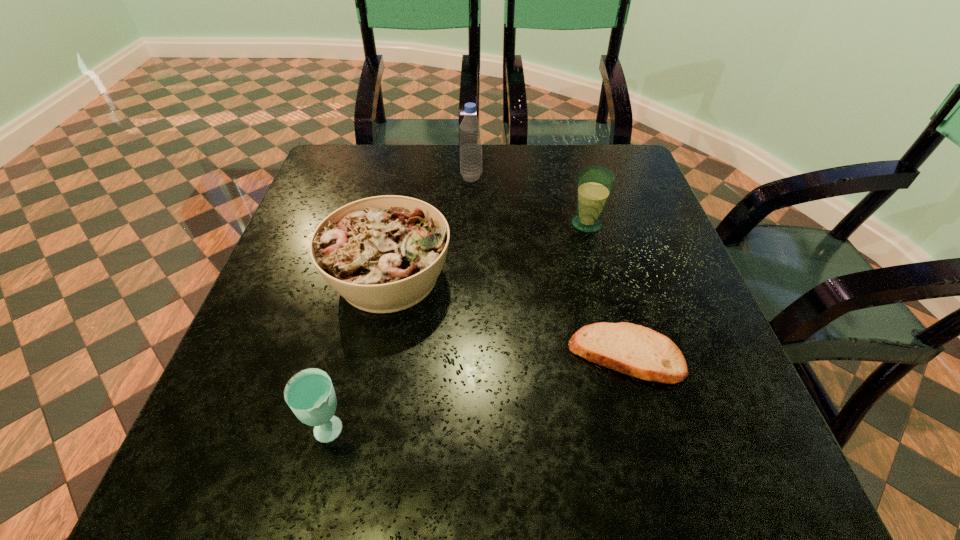
The width and height of the screenshot is (960, 540). Identify the location of bottle. (470, 130).

At what (x,y) coordinates should I click in order to perform the action: click on the tallest object. Please return your answer as a coordinate pair (x, y). This screenshot has width=960, height=540. Looking at the image, I should click on (470, 130).

You are a GUI agent. You are given a task and a screenshot of the screen. Output one action in this format:
    pyautogui.click(x=<x>, y=<y>)
    Task: Click on the right glass
    The height and width of the screenshot is (540, 960).
    Given the screenshot: What is the action you would take?
    pyautogui.click(x=595, y=183)

The height and width of the screenshot is (540, 960). I want to click on the fourth nearest object, so click(x=595, y=183).

Find the location of a particular element. The image size is (960, 540). the nearer glass is located at coordinates (309, 393).

Find the location of `the nearest object`. the nearest object is located at coordinates (309, 393).

At what (x,y) coordinates should I click in order to perform the action: click on salad. Please return your answer as a coordinate pair (x, y). The width and height of the screenshot is (960, 540). Looking at the image, I should click on click(383, 254).

The image size is (960, 540). What are the coordinates of `the shortest object` in the screenshot? It's located at (634, 350).

The height and width of the screenshot is (540, 960). What are the coordinates of `vacant area located 0.250m on the front of the tallest object` in the screenshot? It's located at (469, 246).

Locate an element on the screen. vacant area situated on the left of the fourth nearest object is located at coordinates (458, 224).